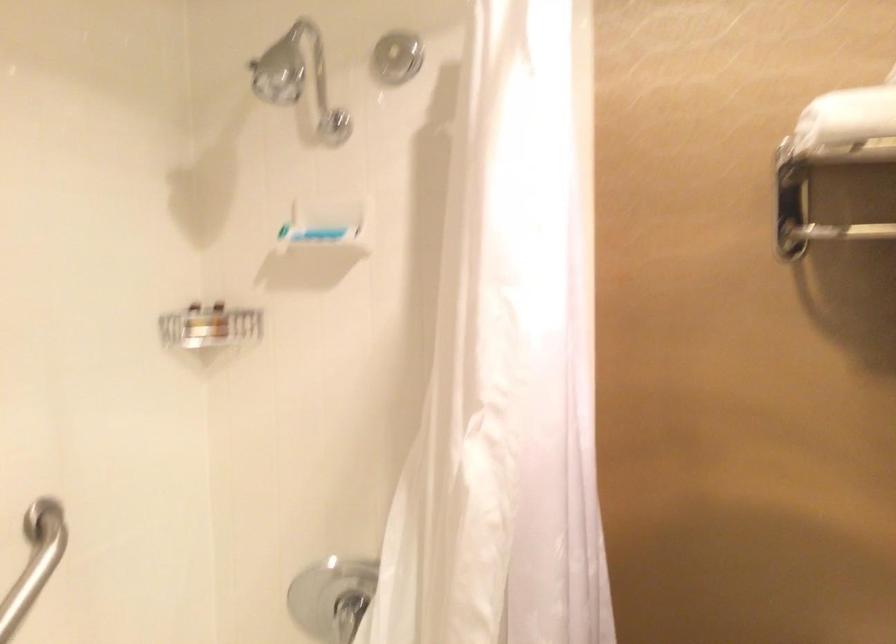
I want to click on chrome faucet handle, so click(348, 614).